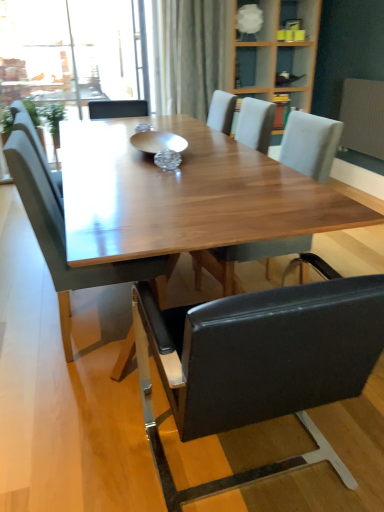
The image size is (384, 512). Identify the location of vacant region to the left of leather-like black chair at center, the second chair in the left-to-right sequence. (82, 436).